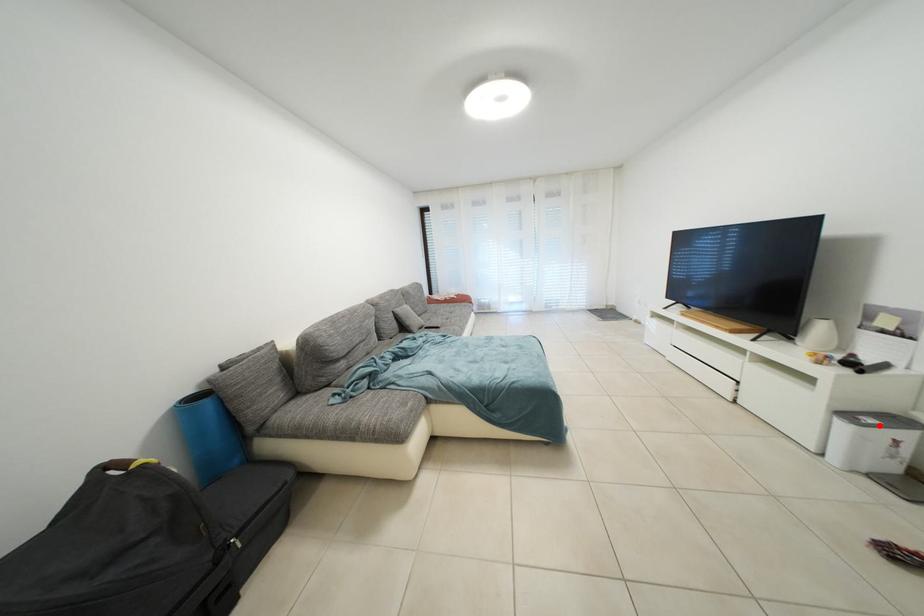
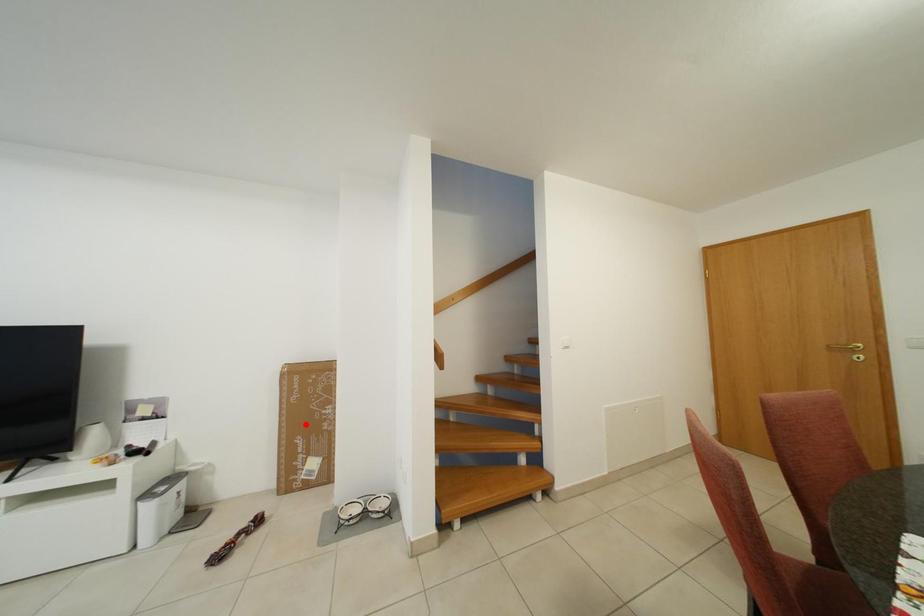
I am providing you with two images of the same scene from different viewpoints. A red point is marked on the first image and another point is marked on the second image. Does the point marked in image1 correspond to the same location as the one in image2?

No